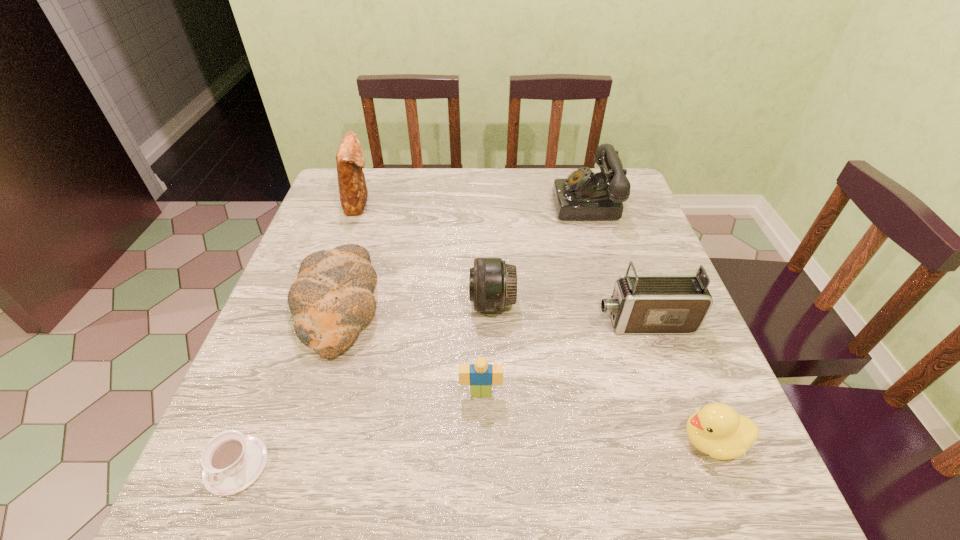
Locate which object is the seventh closest to the duckling. Please provide its 2D coordinates. Your answer should be formatted as a tuple, i.e. [(x, y)], where the tuple contains the x and y coordinates of a point satisfying the conditions above.

[(350, 160)]

Select which object appears as the fourth closest to the telephone. Please provide its 2D coordinates. Your answer should be formatted as a tuple, i.e. [(x, y)], where the tuple contains the x and y coordinates of a point satisfying the conditions above.

[(480, 376)]

The height and width of the screenshot is (540, 960). Identify the location of free space in the image that satisfies the following two spatial constraints: 1. on the beak of the duckling; 2. on the handle side of the teacup. (722, 465).

This screenshot has width=960, height=540. I want to click on free region that satisfies the following two spatial constraints: 1. on the open side of the clutch bag; 2. on the left side of the bread, so click(324, 305).

Locate an element on the screen. free location that satisfies the following two spatial constraints: 1. on the open side of the clutch bag; 2. on the back side of the bread is located at coordinates (324, 305).

The width and height of the screenshot is (960, 540). In order to click on free point that satisfies the following two spatial constraints: 1. at the lens of the camcorder; 2. on the face of the Lego in this screenshot , I will do `click(668, 393)`.